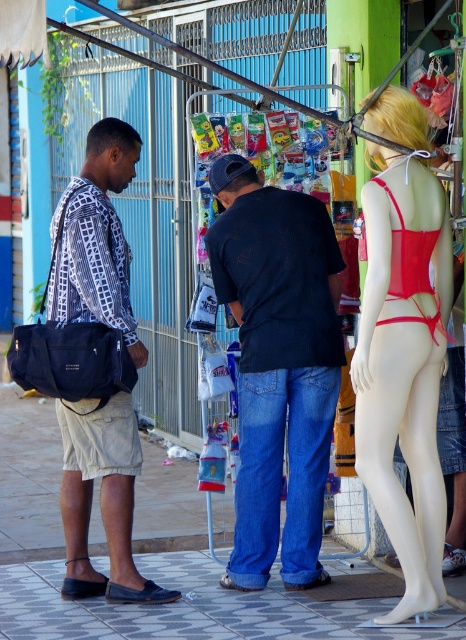
Between dark blue jeans at center and matte red bikini top at right, which one is positioned lower?

dark blue jeans at center is below.

Locate an element on the screen. dark blue jeans at center is located at coordinates (278, 365).

The width and height of the screenshot is (466, 640). What do you see at coordinates (278, 365) in the screenshot?
I see `dark blue jeans at center` at bounding box center [278, 365].

Is point (262, 257) positioned behind point (186, 595)?

No, it is in front of (186, 595).

Image resolution: width=466 pixels, height=640 pixels. I want to click on dark blue jeans at center, so click(278, 365).

Which is more to the left, matte black shirt at left or matte red bikini top at right?

matte black shirt at left is more to the left.

Does point (129, 148) come in front of point (417, 246)?

No, it is not.

Which is in front, point (128, 346) or point (411, 256)?

Positioned in front is point (411, 256).

At what (x,y) coordinates should I click in order to perform the action: click on matte black shirt at left. Please return your answer as a coordinate pair (x, y). This screenshot has height=640, width=466. Looking at the image, I should click on (102, 499).